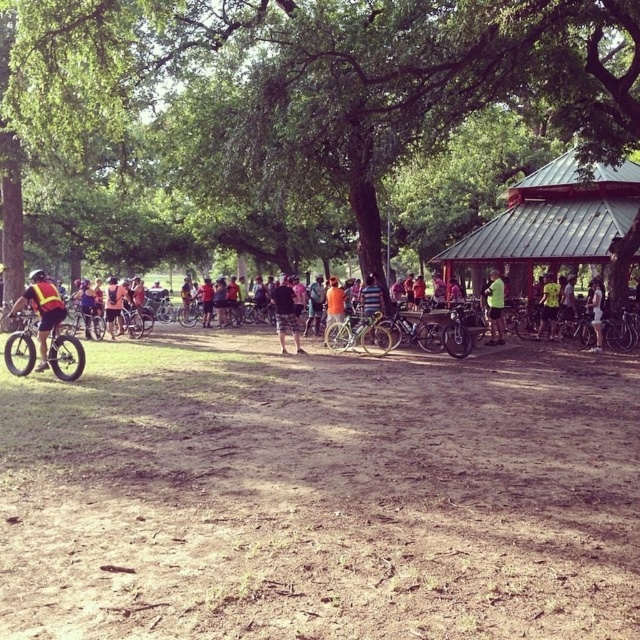
Question: Does brown dirt field at lower center appear on the right side of yellow-green shirt at center-right?

Choices:
 (A) no
 (B) yes

Answer: (A)

Question: Which object appears closest to the camera in this image?

Choices:
 (A) yellow-green shirt at center-right
 (B) black mesh shirt at center
 (C) green fabric shirt at center

Answer: (B)

Question: Which point is farther to the camera?

Choices:
 (A) reflective yellow vest at left
 (B) green fabric shirt at center
 (C) fat tire bike at left
 (D) shiny metallic bicycle at center

Answer: (B)

Question: Where is green fabric shirt at center located in relation to white cotton shirt at center in the image?

Choices:
 (A) left
 (B) right

Answer: (A)

Question: Which of the following is the farthest from the observer?

Choices:
 (A) green fabric shirt at center
 (B) white cotton shirt at center
 (C) brown dirt field at lower center
 (D) shiny metallic bicycle at center

Answer: (A)

Question: Is green matte bicycle at center to the right of green fabric shirt at center from the viewer's perspective?

Choices:
 (A) no
 (B) yes

Answer: (A)